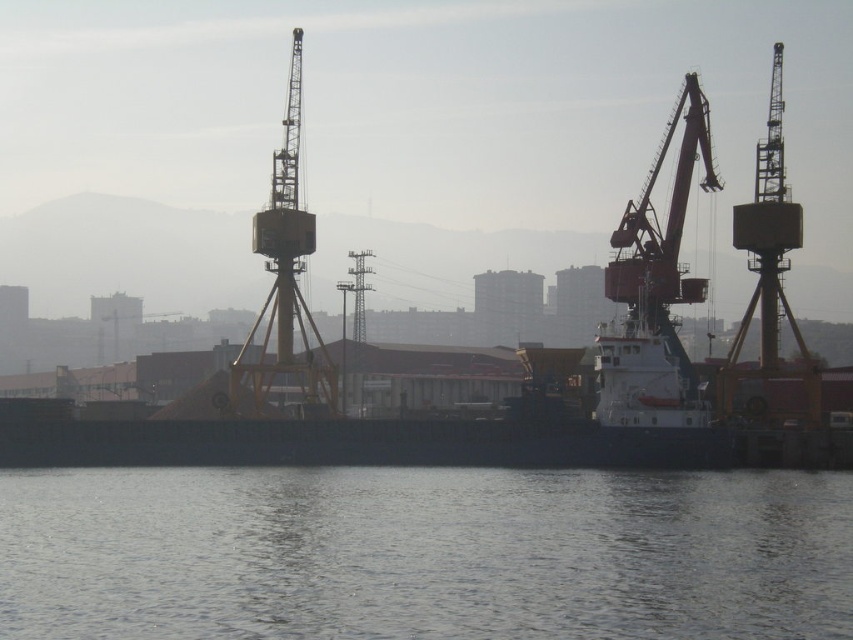
Can you confirm if clear water at lower center is taller than white matte boat at center?

In fact, clear water at lower center may be shorter than white matte boat at center.

Does point (821, 483) lie in front of point (467, 460)?

That is False.

What are the coordinates of `clear water at lower center` in the screenshot? It's located at (424, 554).

What are the coordinates of `clear water at lower center` in the screenshot? It's located at (424, 554).